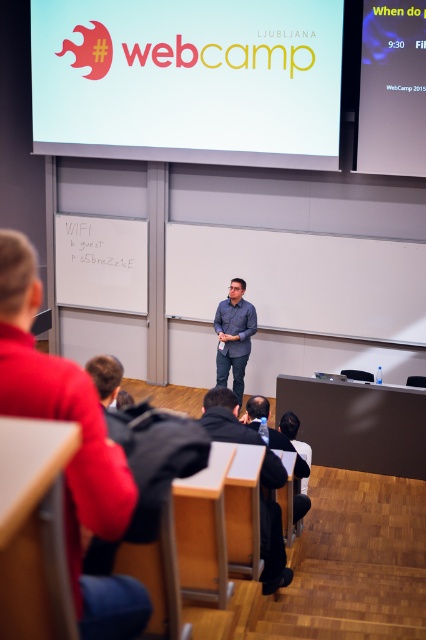
Looking at this image, who is positioned more to the left, black fabric jacket at lower center or dark gray shirt at center?

black fabric jacket at lower center is more to the left.

Can you confirm if black fabric jacket at lower center is positioned to the right of dark gray shirt at center?

No, black fabric jacket at lower center is not to the right of dark gray shirt at center.

Who is more forward, (264, 458) or (290, 442)?

Point (264, 458) is more forward.

The width and height of the screenshot is (426, 640). In order to click on black fabric jacket at lower center in this screenshot , I will do `click(271, 547)`.

Does point (259, 579) come in front of point (227, 365)?

Yes, it is.

Between black fabric jacket at lower center and blue shirt at center, which one appears on the left side from the viewer's perspective?

Positioned to the left is blue shirt at center.

Is point (236, 400) farther from viewer compared to point (230, 282)?

No, it is in front of (230, 282).

The image size is (426, 640). In order to click on black fabric jacket at lower center in this screenshot , I will do `click(271, 547)`.

Is matte gray shirt at center to the left of dark gray shirt at center from the viewer's perspective?

Correct, you'll find matte gray shirt at center to the left of dark gray shirt at center.

Between point (22, 339) and point (247, 410), which one is positioned in front?

Point (22, 339)

Who is more forward, (77, 525) or (290, 449)?

Point (77, 525) is more forward.

Where is `matte gray shirt at center`? This screenshot has height=640, width=426. matte gray shirt at center is located at coordinates (77, 449).